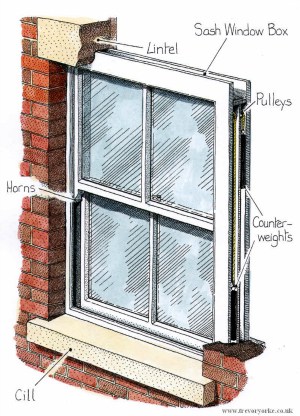
Identify the location of turn this to lock or unlock the window. pyautogui.click(x=157, y=196).